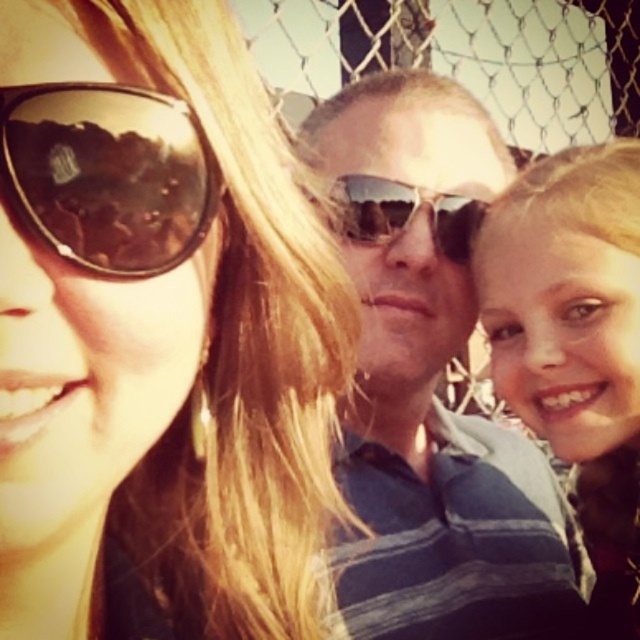
Can you confirm if matte black sunglasses at upper left is shorter than shiny brown sunglasses at upper left?

In fact, matte black sunglasses at upper left may be taller than shiny brown sunglasses at upper left.

Can you confirm if matte black sunglasses at upper left is positioned to the right of shiny brown sunglasses at upper left?

Yes, matte black sunglasses at upper left is to the right of shiny brown sunglasses at upper left.

The width and height of the screenshot is (640, 640). Find the location of `matte black sunglasses at upper left`. matte black sunglasses at upper left is located at coordinates (160, 333).

From the picture: Who is shorter, matte black sunglasses at upper left or blonde hair at center?

Standing shorter between the two is matte black sunglasses at upper left.

Looking at this image, is matte black sunglasses at upper left positioned before blonde hair at center?

Yes, it is.

At what (x,y) coordinates should I click in order to perform the action: click on matte black sunglasses at upper left. Please return your answer as a coordinate pair (x, y). Looking at the image, I should click on (160, 333).

Is matte blue shirt at center to the right of blonde hair at center from the viewer's perspective?

In fact, matte blue shirt at center is to the left of blonde hair at center.

Is matte blue shirt at center thinner than blonde hair at center?

Incorrect, matte blue shirt at center's width is not less than blonde hair at center's.

The width and height of the screenshot is (640, 640). Find the location of `matte blue shirt at center`. matte blue shirt at center is located at coordinates (433, 384).